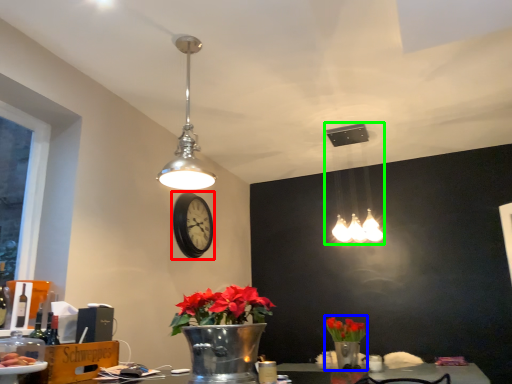
Question: Which object is the closest to the clock (highlighted by a red box)? Choose among these: floral arrangement (highlighted by a blue box) or lamp (highlighted by a green box).

Choices:
 (A) floral arrangement
 (B) lamp

Answer: (A)